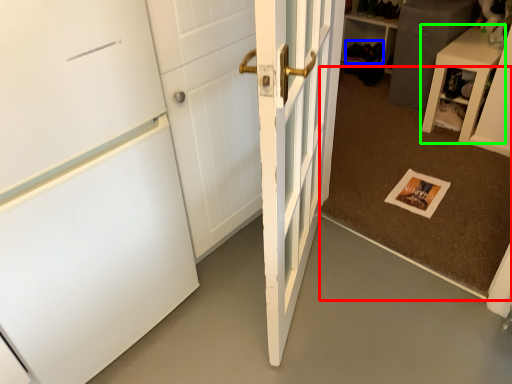
Question: Which object is the closest to the doormat (highlighted by a red box)? Choose among these: shoe (highlighted by a blue box) or furniture (highlighted by a green box).

Choices:
 (A) shoe
 (B) furniture

Answer: (B)